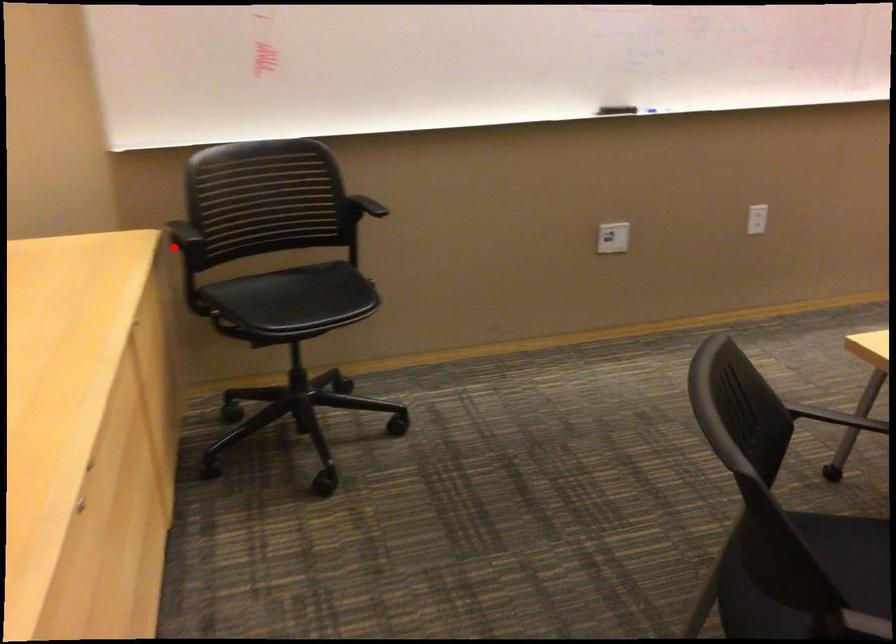
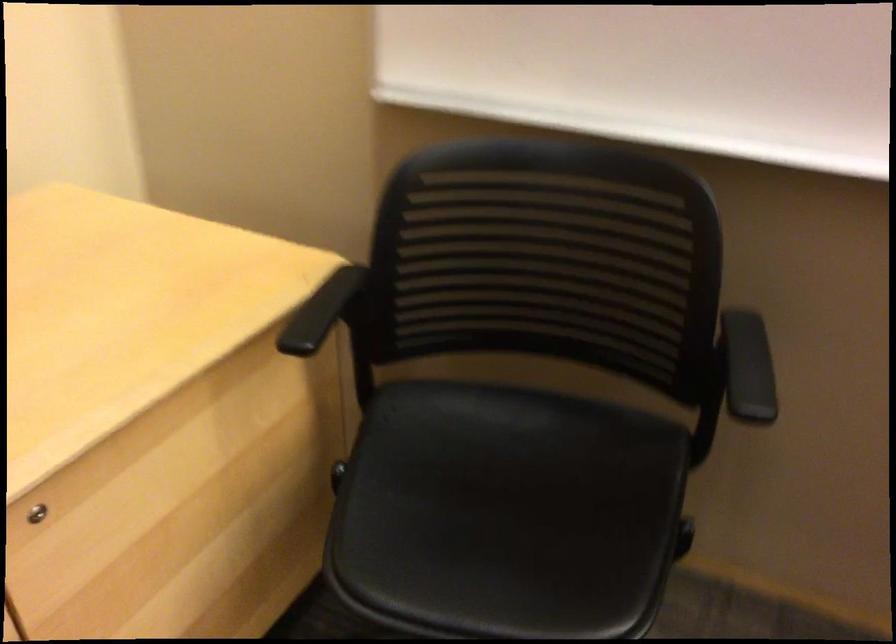
Question: I am providing you with two images of the same scene from different viewpoints. Given a red point in image1, look at the same physical point in image2. Is it:

Choices:
 (A) Closer to the viewpoint
 (B) Farther from the viewpoint

Answer: (A)